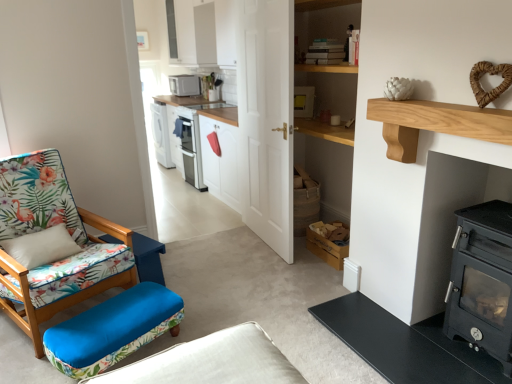
Question: Considering the relative sizes of floral fabric chair at left and blue floral fabric studio couch at lower left in the image provided, is floral fabric chair at left taller than blue floral fabric studio couch at lower left?

Choices:
 (A) yes
 (B) no

Answer: (A)

Question: Are floral fabric chair at left and blue floral fabric studio couch at lower left located far from each other?

Choices:
 (A) no
 (B) yes

Answer: (B)

Question: Is floral fabric chair at left not within blue floral fabric studio couch at lower left?

Choices:
 (A) no
 (B) yes

Answer: (B)

Question: Is blue floral fabric studio couch at lower left inside floral fabric chair at left?

Choices:
 (A) yes
 (B) no

Answer: (B)

Question: Can you confirm if floral fabric chair at left is smaller than blue floral fabric studio couch at lower left?

Choices:
 (A) no
 (B) yes

Answer: (A)

Question: From their relative heights in the image, would you say blue fabric swivel chair at left is taller or shorter than floral fabric chair at left?

Choices:
 (A) short
 (B) tall

Answer: (A)

Question: Would you say blue fabric swivel chair at left is to the left or to the right of floral fabric chair at left in the picture?

Choices:
 (A) right
 (B) left

Answer: (A)

Question: Is blue fabric swivel chair at left situated inside floral fabric chair at left or outside?

Choices:
 (A) inside
 (B) outside

Answer: (B)

Question: Considering their positions, is blue fabric swivel chair at left located in front of or behind floral fabric chair at left?

Choices:
 (A) front
 (B) behind

Answer: (A)

Question: Is floral fabric chair at left in front of or behind light brown wood at upper right in the image?

Choices:
 (A) front
 (B) behind

Answer: (B)

Question: Is point (41, 301) positioned closer to the camera than point (397, 137)?

Choices:
 (A) closer
 (B) farther

Answer: (B)

Question: Is floral fabric chair at left wider or thinner than light brown wood at upper right?

Choices:
 (A) thin
 (B) wide

Answer: (B)

Question: From a real-world perspective, is floral fabric chair at left physically located above or below light brown wood at upper right?

Choices:
 (A) above
 (B) below

Answer: (B)

Question: Considering the positions of point (141, 246) and point (463, 337), is point (141, 246) closer or farther from the camera than point (463, 337)?

Choices:
 (A) farther
 (B) closer

Answer: (A)

Question: Is blue fabric ottoman at lower left bigger or smaller than black matte wood burning stove at right?

Choices:
 (A) big
 (B) small

Answer: (B)